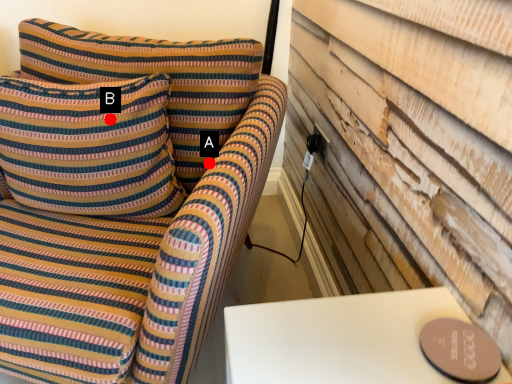
Question: Two points are circled on the image, labeled by A and B beside each circle. Which point is further to the camera?

Choices:
 (A) A is further
 (B) B is further

Answer: (A)